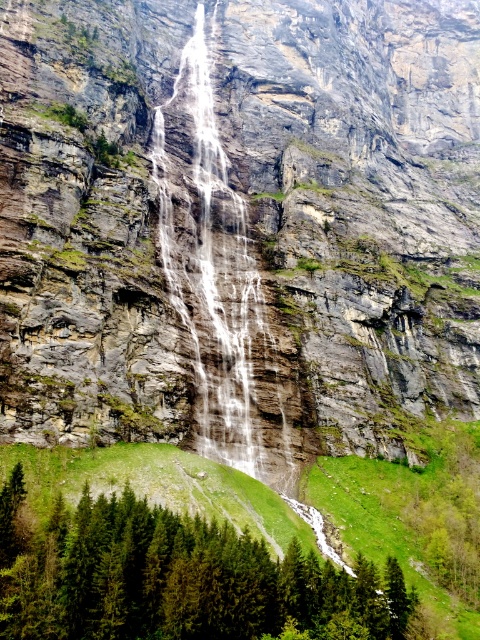
Is point (7, 508) less distant than point (254, 301)?

That is True.

Image resolution: width=480 pixels, height=640 pixels. I want to click on green matte tree at lower left, so click(x=178, y=579).

Locate an element on the screen. The height and width of the screenshot is (640, 480). green matte tree at lower left is located at coordinates point(178,579).

Does rocky cliff face at center lie behind clear water at center?

No.

Is point (312, 388) positioned before point (213, 454)?

That is False.

This screenshot has height=640, width=480. I want to click on rocky cliff face at center, so click(359, 198).

Does rocky cliff face at center lie in front of green matte tree at lower left?

No, it is not.

Who is higher up, rocky cliff face at center or green matte tree at lower left?

Positioned higher is rocky cliff face at center.

What do you see at coordinates (359, 198) in the screenshot? I see `rocky cliff face at center` at bounding box center [359, 198].

This screenshot has width=480, height=640. I want to click on rocky cliff face at center, so click(x=359, y=198).